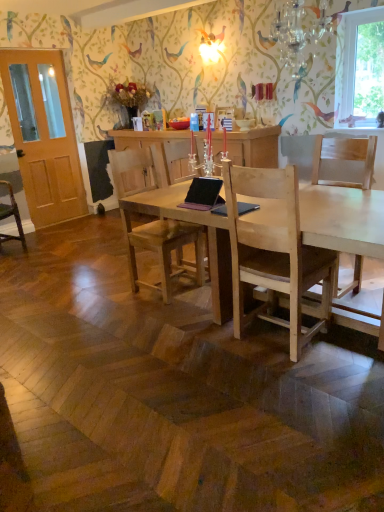
Question: Is light wood chair at center, marked as the 3th chair in a left-to-right arrangement, further to camera compared to clear glass window at upper right?

Choices:
 (A) yes
 (B) no

Answer: (B)

Question: Is light wood chair at center, marked as the 3th chair in a left-to-right arrangement, located outside clear glass window at upper right?

Choices:
 (A) yes
 (B) no

Answer: (A)

Question: From a real-world perspective, is light wood chair at center, which is the third chair in back-to-front order, positioned over clear glass window at upper right based on gravity?

Choices:
 (A) yes
 (B) no

Answer: (B)

Question: Is there a large distance between light wood chair at center, marked as the 3th chair in a left-to-right arrangement, and clear glass window at upper right?

Choices:
 (A) no
 (B) yes

Answer: (B)

Question: Is light wood chair at center, which is the third chair in back-to-front order, facing away from clear glass window at upper right?

Choices:
 (A) yes
 (B) no

Answer: (A)

Question: From the image's perspective, is light brown wooden door at left positioned above or below wooden chair at left, which is counted as the 1th chair, starting from the back?

Choices:
 (A) below
 (B) above

Answer: (B)

Question: Visually, is light brown wooden door at left positioned to the left or to the right of wooden chair at left, the 1th chair in the left-to-right sequence?

Choices:
 (A) left
 (B) right

Answer: (B)

Question: In terms of width, does light brown wooden door at left look wider or thinner when compared to wooden chair at left, which is counted as the 1th chair, starting from the back?

Choices:
 (A) thin
 (B) wide

Answer: (A)

Question: Which is correct: light brown wooden door at left is inside wooden chair at left, the 3th chair when ordered from right to left, or outside of it?

Choices:
 (A) outside
 (B) inside

Answer: (A)

Question: From a real-world perspective, is pink leather laptop at center positioned above or below light wood chair at center, which is the third chair in back-to-front order?

Choices:
 (A) below
 (B) above

Answer: (B)

Question: Which is correct: pink leather laptop at center is inside light wood chair at center, marked as the first chair in a front-to-back arrangement, or outside of it?

Choices:
 (A) inside
 (B) outside

Answer: (B)

Question: In the image, is pink leather laptop at center on the left side or the right side of light wood chair at center, marked as the first chair in a front-to-back arrangement?

Choices:
 (A) right
 (B) left

Answer: (B)

Question: From the image's perspective, relative to light wood chair at center, which is the third chair in back-to-front order, is pink leather laptop at center above or below?

Choices:
 (A) below
 (B) above

Answer: (B)

Question: Looking at their shapes, would you say crystal glass chandelier at upper center is wider or thinner than natural wood desk at center?

Choices:
 (A) thin
 (B) wide

Answer: (A)

Question: Is point (296, 47) closer or farther from the camera than point (317, 242)?

Choices:
 (A) farther
 (B) closer

Answer: (A)